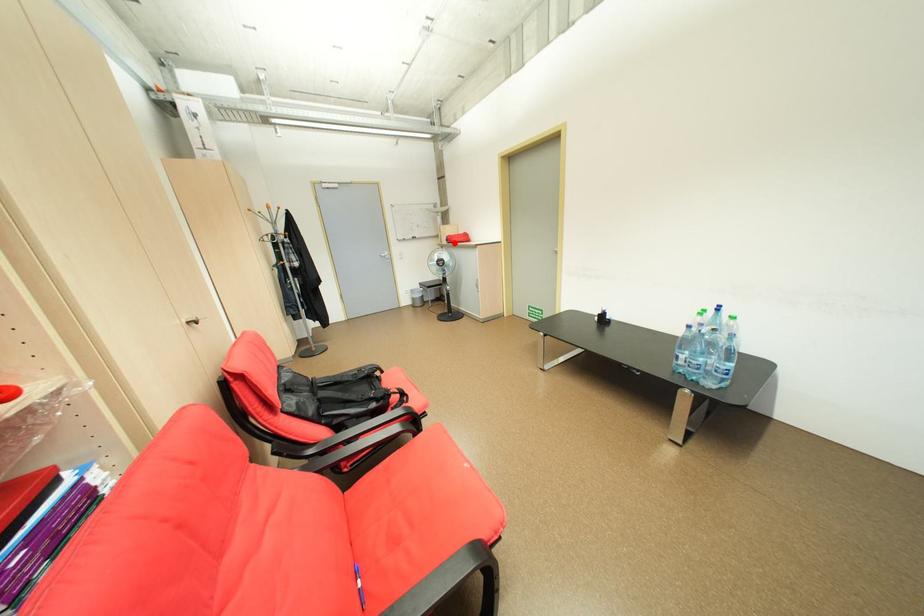
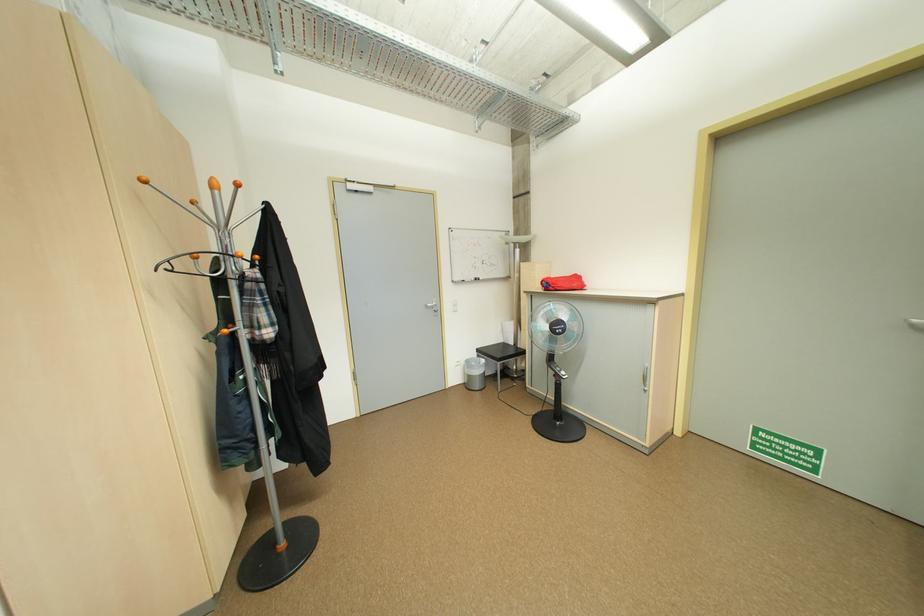
Where in the second image is the point corresponding to the highlighted location from the first image?

(550, 290)